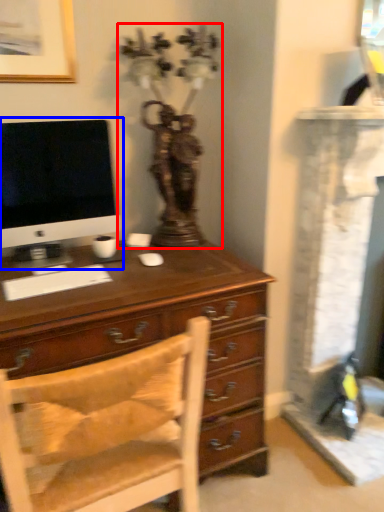
Question: Among these objects, which one is farthest to the camera, antique (highlighted by a red box) or computer monitor (highlighted by a blue box)?

Choices:
 (A) antique
 (B) computer monitor

Answer: (A)